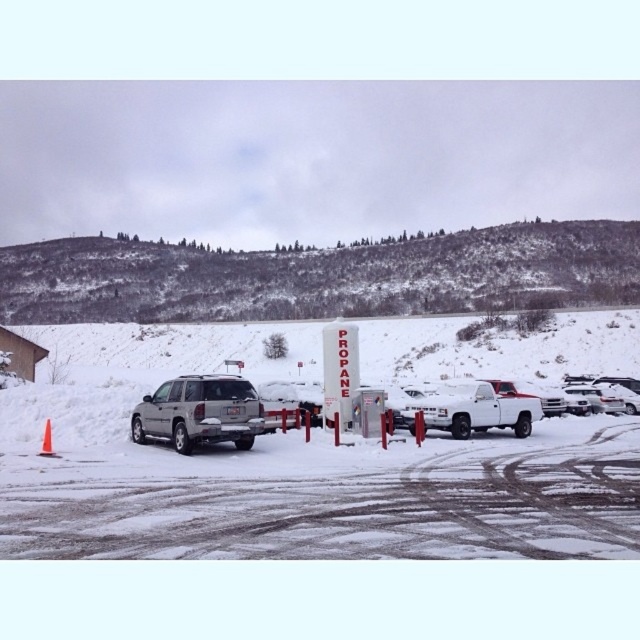
You are a delivery driver who needs to park your truck in the parking lot. You see the white matte truck at center and the orange plastic cone at lower left. Which vehicle has a wider body?

The orange plastic cone at lower left is wider than the white matte truck at center, so the cone has a wider body.

You are a delivery driver who needs to park your vehicle in the parking lot shown. You see the satin silver suv at center and the orange plastic cone at lower left. Based on their positions, can you determine if there is enough space to park your vehicle between them?

The satin silver suv at center is above the orange plastic cone at lower left, so there is vertical space between them. However, without knowing the exact dimensions of your vehicle and the distance between them, it is uncertain if there is enough space to park between them.

You are standing in a snowy parking lot and want to reach a point that is 65.31 feet away from your current position. The point is marked as point (182,388). Given the vehicles and obstacles in the scene, can you safely walk to that point without crossing any vehicles or restricted areas?

The distance between you and point (182,388) is 65.31 feet. However, there are vehicles like the silver SUV and white pickup truck with a red cab, as well as a propane tank surrounded by red poles in the parking lot. To safely reach the point without crossing vehicles or restricted areas, you should navigate around these obstacles, ensuring you stay clear of the propane tank area marked by the red poles and avoid walking through any parked vehicles.